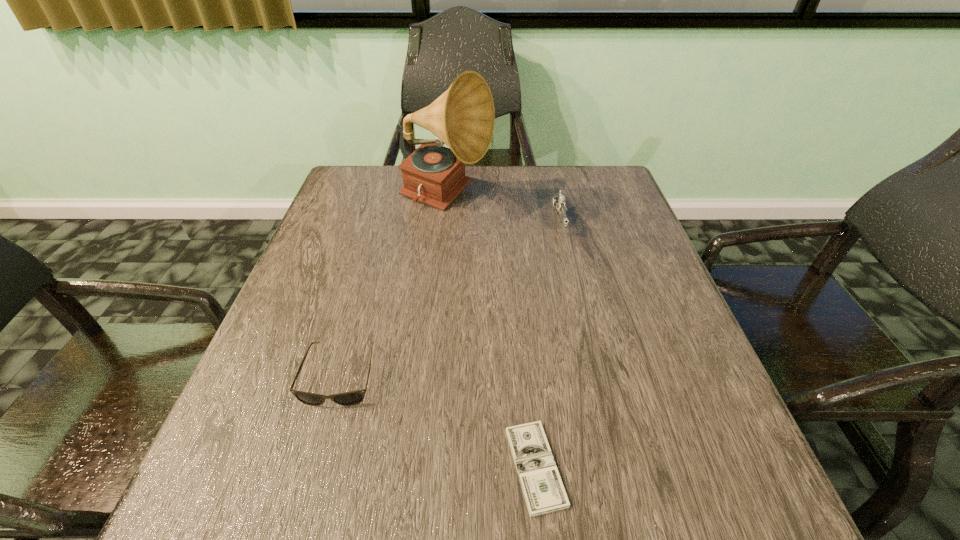
You are a GUI agent. You are given a task and a screenshot of the screen. Output one action in this format:
    pyautogui.click(x=<x>, y=<y>)
    Task: Click on the vacant area between the nearest object and the third tallest object
    The height and width of the screenshot is (540, 960).
    Given the screenshot: What is the action you would take?
    pyautogui.click(x=438, y=421)

Identify the location of free area in between the phonograph record and the shortest object. The image size is (960, 540). (491, 334).

I want to click on vacant area between the sunglasses and the third shortest object, so click(x=450, y=297).

Image resolution: width=960 pixels, height=540 pixels. I want to click on free space between the phonograph record and the third object from left to right, so click(x=491, y=334).

Where is `free space between the second tallest object and the second object from right to left`? Image resolution: width=960 pixels, height=540 pixels. free space between the second tallest object and the second object from right to left is located at coordinates (547, 343).

You are a GUI agent. You are given a task and a screenshot of the screen. Output one action in this format:
    pyautogui.click(x=<x>, y=<y>)
    Task: Click on the vacant area that lies between the nearest object and the gun
    
    Given the screenshot: What is the action you would take?
    pyautogui.click(x=547, y=343)

The height and width of the screenshot is (540, 960). I want to click on empty space that is in between the sunglasses and the phonograph record, so click(x=393, y=288).

In order to click on empty space that is in between the second shortest object and the rightmost object in this screenshot , I will do `click(450, 297)`.

This screenshot has height=540, width=960. Find the location of `free space between the rightmost object and the second object from right to left`. free space between the rightmost object and the second object from right to left is located at coordinates (547, 343).

The height and width of the screenshot is (540, 960). Find the location of `free space between the second shortest object and the shortest object`. free space between the second shortest object and the shortest object is located at coordinates (438, 421).